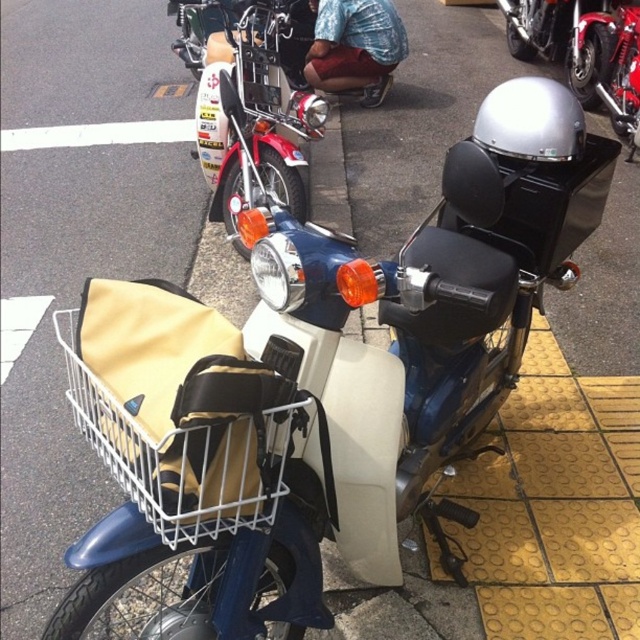
Who is lower down, shiny chrome handlebars at upper center or shiny chrome helmet at upper right?

shiny chrome handlebars at upper center

Does point (260, 76) lie behind point (588, 74)?

No, it is in front of (588, 74).

Locate an element on the screen. shiny chrome handlebars at upper center is located at coordinates (250, 112).

Between point (182, 19) and point (138, 474), which one is positioned in front?

Positioned in front is point (138, 474).

Can you confirm if shiny chrome handlebars at upper center is smaller than beige fabric basket at center?

No, shiny chrome handlebars at upper center is not smaller than beige fabric basket at center.

Between point (212, 74) and point (202, 493), which one is positioned behind?

The point (212, 74) is behind.

Locate an element on the screen. Image resolution: width=640 pixels, height=640 pixels. shiny chrome handlebars at upper center is located at coordinates [250, 112].

From the picture: Which is more to the left, beige fabric basket at center or shiny chrome helmet at upper right?

Positioned to the left is beige fabric basket at center.

Locate an element on the screen. The height and width of the screenshot is (640, 640). beige fabric basket at center is located at coordinates (160, 452).

Who is more forward, (282, 490) or (595, 35)?

Point (282, 490) is more forward.

The height and width of the screenshot is (640, 640). What are the coordinates of `beige fabric basket at center` in the screenshot? It's located at pos(160,452).